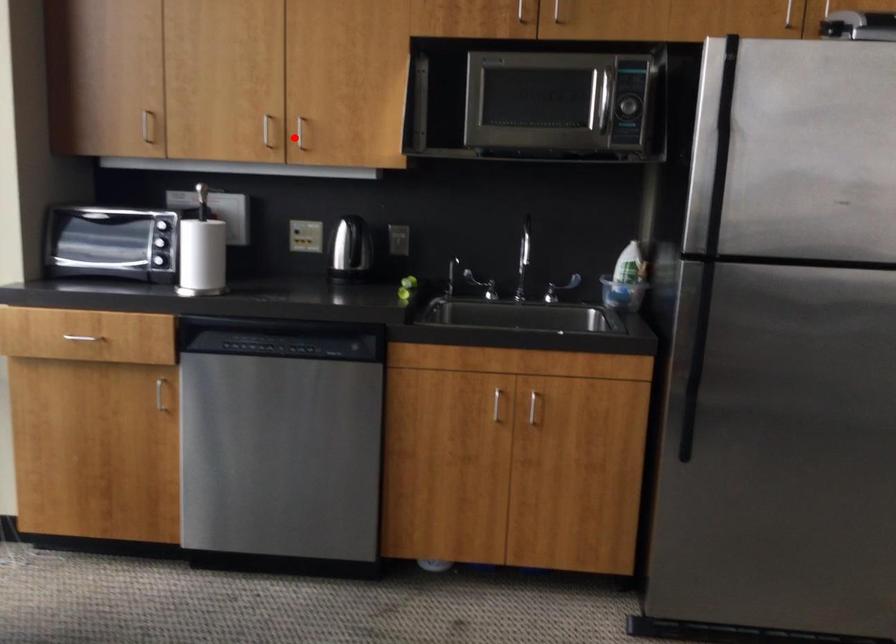
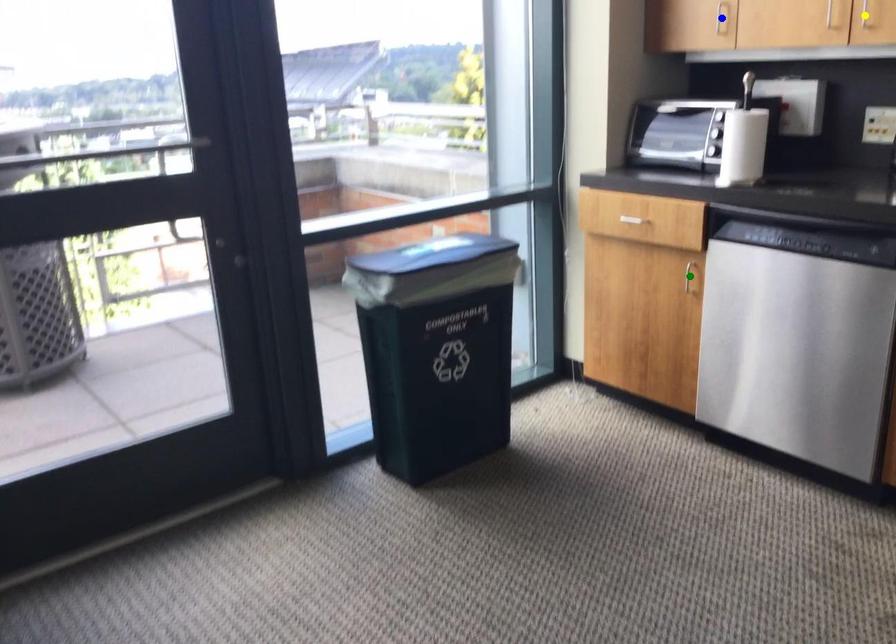
Question: I am providing you with two images of the same scene from different viewpoints. A red point is marked on the first image. You are given multiple points on the second image. Which mark in image 2 goes with the point in image 1?

Choices:
 (A) blue point
 (B) yellow point
 (C) green point

Answer: (B)